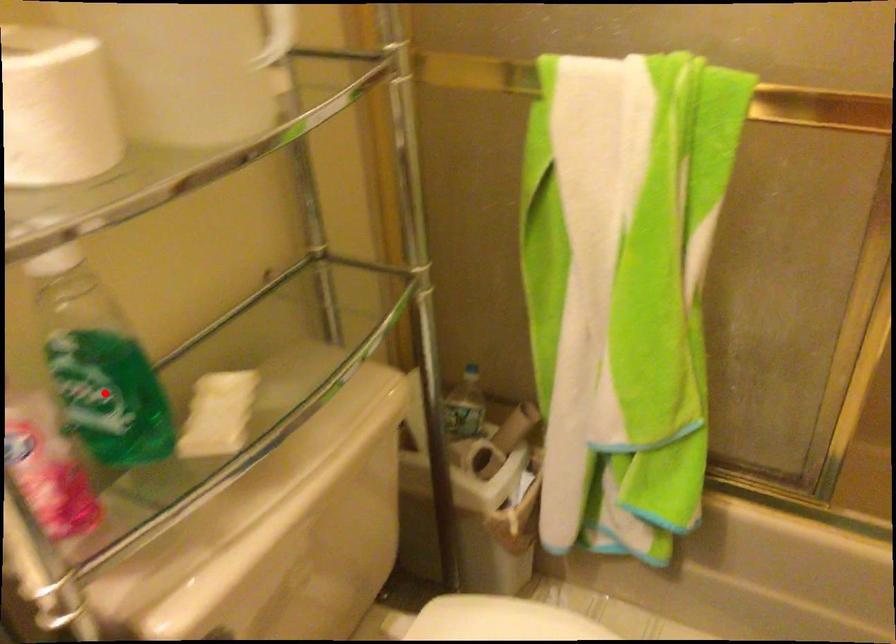
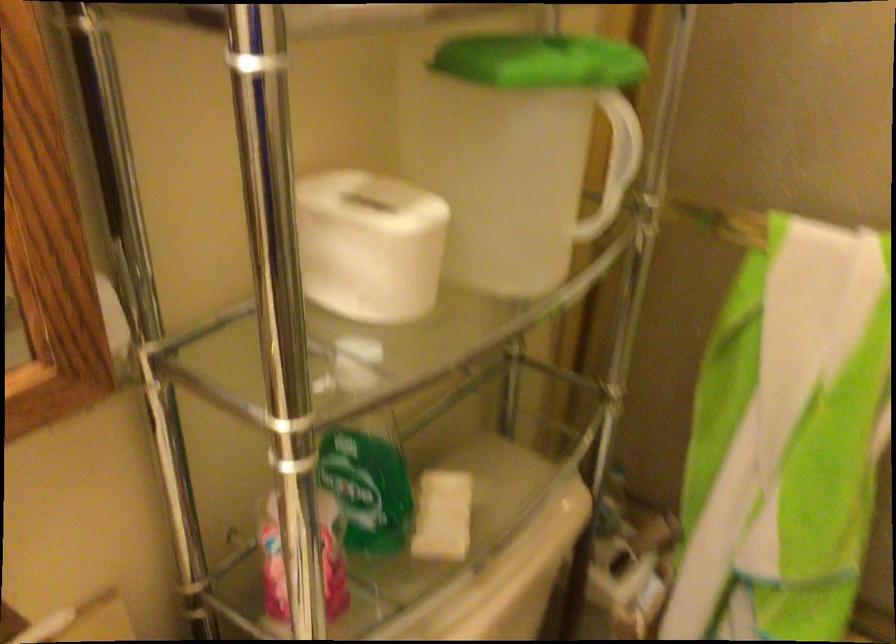
In the second image, find the point that corresponds to the highlighted location in the first image.

(367, 489)